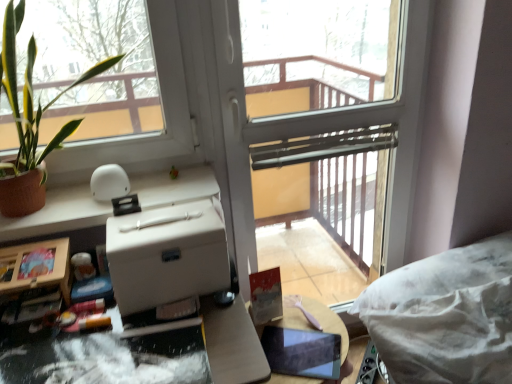
Question: Is green leafy plant at left looking in the opposite direction of wooden round table at center?

Choices:
 (A) yes
 (B) no

Answer: (B)

Question: Does green leafy plant at left have a lesser height compared to wooden round table at center?

Choices:
 (A) no
 (B) yes

Answer: (A)

Question: Does green leafy plant at left have a larger size compared to wooden round table at center?

Choices:
 (A) no
 (B) yes

Answer: (B)

Question: From the image's perspective, is green leafy plant at left located beneath wooden round table at center?

Choices:
 (A) yes
 (B) no

Answer: (B)

Question: Does green leafy plant at left come in front of wooden round table at center?

Choices:
 (A) no
 (B) yes

Answer: (B)

Question: Would you say wooden round table at center is part of green leafy plant at left's contents?

Choices:
 (A) no
 (B) yes

Answer: (A)

Question: Is green leafy plant at left further to the viewer compared to white matte cardboard box at center?

Choices:
 (A) no
 (B) yes

Answer: (A)

Question: Is green leafy plant at left not near white matte cardboard box at center?

Choices:
 (A) no
 (B) yes

Answer: (A)

Question: From the image's perspective, would you say green leafy plant at left is positioned over white matte cardboard box at center?

Choices:
 (A) no
 (B) yes

Answer: (B)

Question: Can you confirm if green leafy plant at left is bigger than white matte cardboard box at center?

Choices:
 (A) yes
 (B) no

Answer: (A)

Question: Is green leafy plant at left looking in the opposite direction of white matte cardboard box at center?

Choices:
 (A) yes
 (B) no

Answer: (B)

Question: Could you tell me if green leafy plant at left is facing white matte cardboard box at center?

Choices:
 (A) no
 (B) yes

Answer: (A)

Question: Considering the relative sizes of wooden round table at center and transparent glass screen door at center in the image provided, is wooden round table at center wider than transparent glass screen door at center?

Choices:
 (A) no
 (B) yes

Answer: (B)